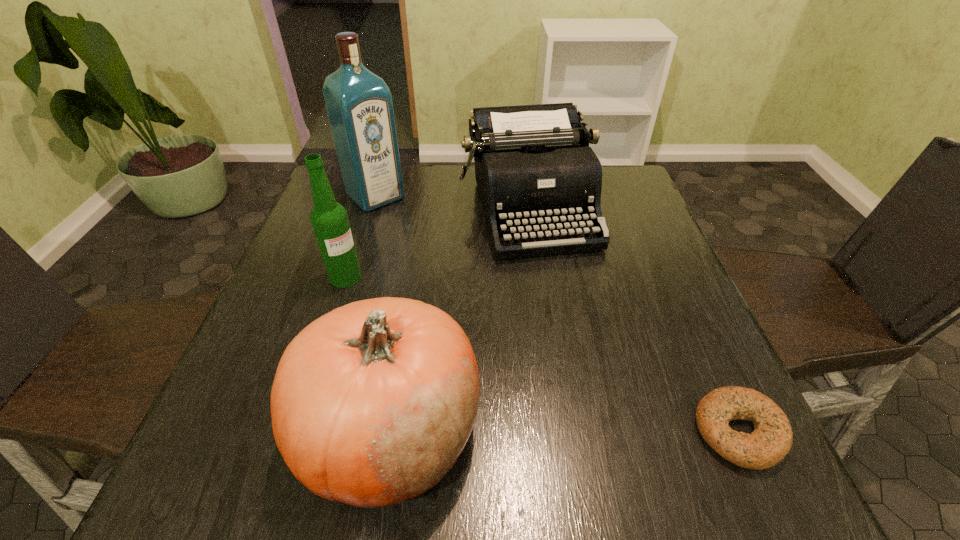
This screenshot has height=540, width=960. Identify the location of free spot located 0.300m on the typing side of the fourth tallest object. (588, 369).

Where is `free space located 0.070m on the label of the third nearest object`? free space located 0.070m on the label of the third nearest object is located at coordinates (374, 300).

Where is `free spot located 0.090m on the label of the third nearest object`? free spot located 0.090m on the label of the third nearest object is located at coordinates point(380,305).

Locate an element on the screen. vacant area located on the label of the third nearest object is located at coordinates (396, 317).

I want to click on blank space located on the flat label side of the liquor, so click(424, 245).

Locate an element on the screen. The width and height of the screenshot is (960, 540). free space located 0.290m on the flat label side of the liquor is located at coordinates (450, 269).

In order to click on vacant space situated 0.250m on the flat label side of the liquor in this screenshot , I will do `click(441, 260)`.

The height and width of the screenshot is (540, 960). I want to click on typewriter situated at the far edge, so click(x=534, y=168).

I want to click on liquor present at the far edge, so click(359, 104).

Locate an element on the screen. pumpkin that is at the near edge is located at coordinates click(372, 403).